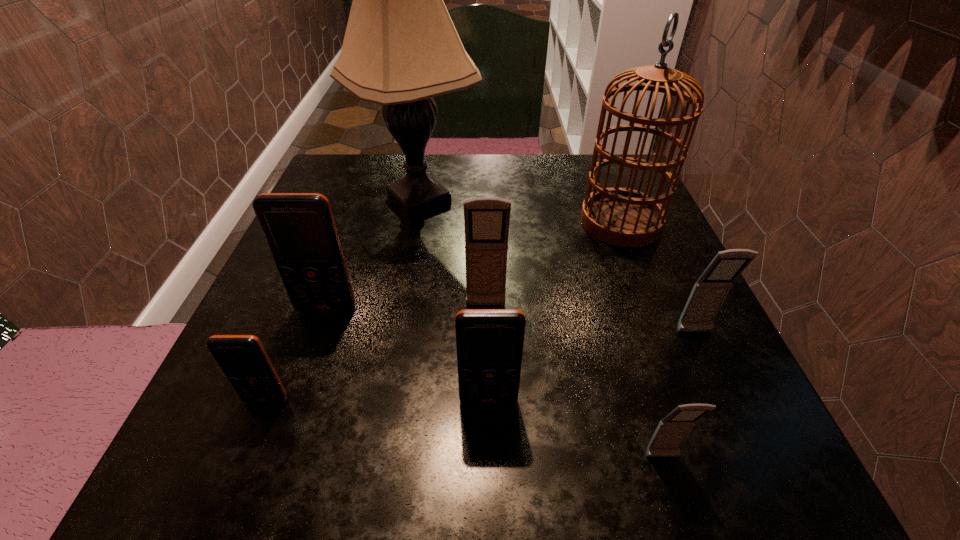
The height and width of the screenshot is (540, 960). Identify the location of vacant space at the right edge of the desktop. (659, 265).

This screenshot has height=540, width=960. In the image, there is a desktop. What are the coordinates of `blank space at the far left corner` in the screenshot? It's located at (391, 169).

Locate an element on the screen. vacant space at the near left corner of the desktop is located at coordinates (265, 434).

Identify the location of vacant region at the near right corner of the desktop. (798, 492).

Identify the location of vacant point located between the farthest gray cellular telephone and the fourth nearest object. (590, 320).

Locate an element on the screen. Image resolution: width=960 pixels, height=540 pixels. free spot between the tallest object and the fourth nearest object is located at coordinates (557, 266).

At what (x,y) coordinates should I click in order to perform the action: click on free space between the lamp and the rightmost orange cellular telephone. Please return your answer as a coordinate pair (x, y). The width and height of the screenshot is (960, 540). Looking at the image, I should click on tap(454, 300).

The height and width of the screenshot is (540, 960). Identify the location of empty location between the lamp and the biggest gray cellular telephone. (452, 253).

The image size is (960, 540). Find the location of `vacant space that's between the rightmost gray cellular telephone and the seventh shortest object`. vacant space that's between the rightmost gray cellular telephone and the seventh shortest object is located at coordinates (658, 278).

Where is `free space between the second biggest orange cellular telephone and the fourth nearest object`? The height and width of the screenshot is (540, 960). free space between the second biggest orange cellular telephone and the fourth nearest object is located at coordinates (591, 366).